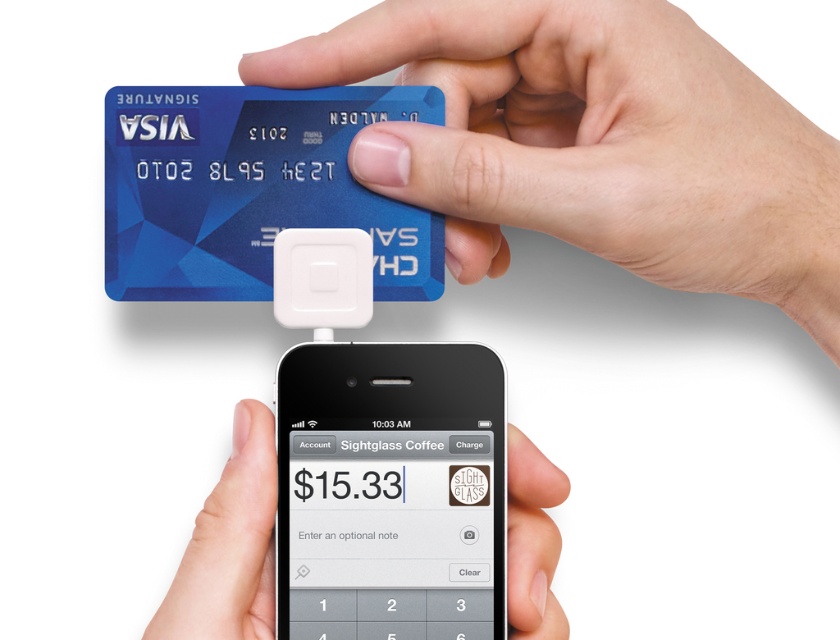
Consider the image. You are trying to locate the black plastic phone at center in the image. What are the coordinates where you can find it?

The black plastic phone at center can be found at coordinates point [390,492].